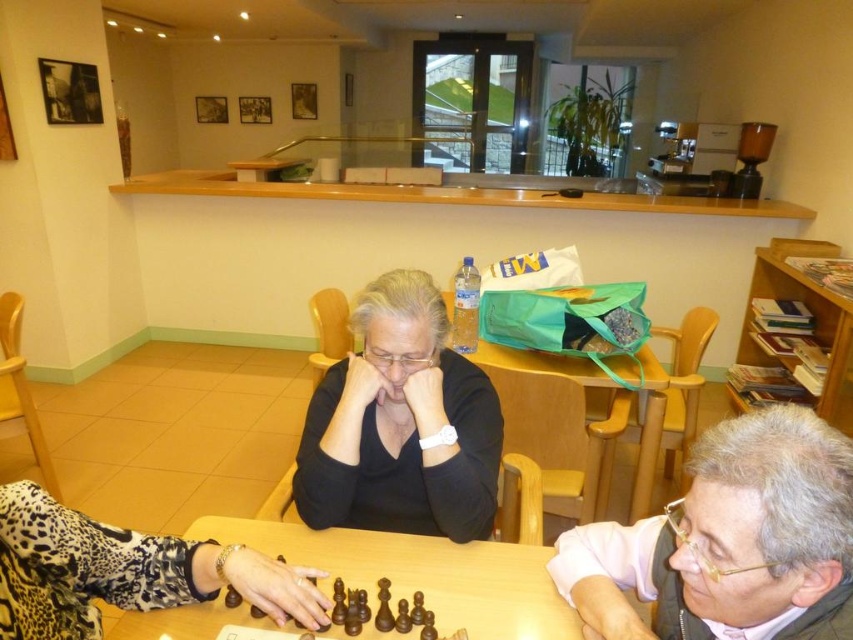
Question: Can you confirm if wooden at center is bigger than dark wood chess set at center?

Choices:
 (A) no
 (B) yes

Answer: (B)

Question: In this image, where is gray hair at upper right located relative to dark wood chess set at center?

Choices:
 (A) left
 (B) right

Answer: (B)

Question: Which object is the farthest from the dark wood chess set at center?

Choices:
 (A) black matte sweater at center
 (B) gray hair at upper right
 (C) wooden at center
 (D) green fabric bag at center

Answer: (D)

Question: Which object is the closest to the dark wood chess set at center?

Choices:
 (A) black matte sweater at center
 (B) green fabric bag at center

Answer: (A)

Question: Can you confirm if wooden at center is positioned to the right of dark wood chess set at center?

Choices:
 (A) no
 (B) yes

Answer: (B)

Question: Which point is farther to the camera?

Choices:
 (A) dark wood chess set at center
 (B) wooden at center
 (C) gray hair at upper right

Answer: (B)